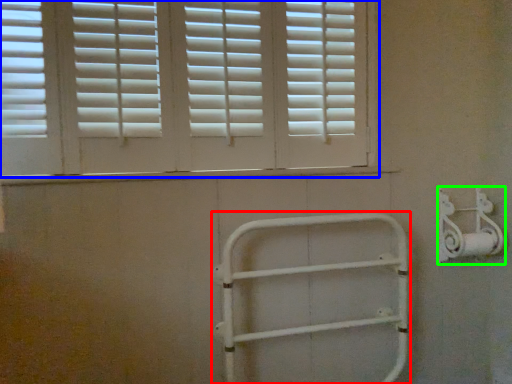
Question: Which object is the farthest from rail (highlighted by a red box)? Choose among these: window (highlighted by a blue box) or metal (highlighted by a green box).

Choices:
 (A) window
 (B) metal

Answer: (A)